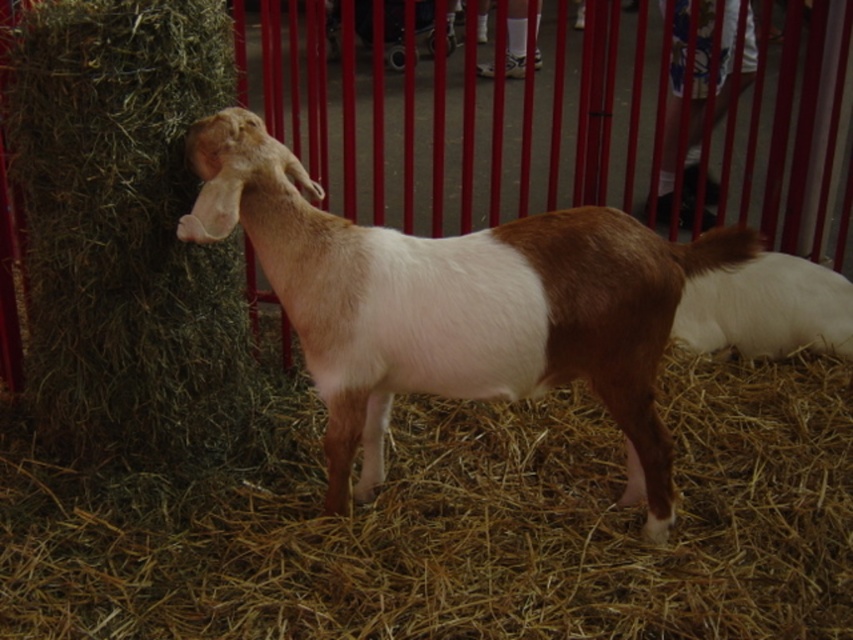
Is point (485, 458) positioned behind point (715, 285)?

No, (485, 458) is in front of (715, 285).

Locate an element on the screen. This screenshot has height=640, width=853. brown straw at center is located at coordinates (469, 525).

Find the location of a particular element. The height and width of the screenshot is (640, 853). brown straw at center is located at coordinates (469, 525).

In the scene shown: Does brown straw at center appear on the right side of brown/white fur goat at center?

Indeed, brown straw at center is positioned on the right side of brown/white fur goat at center.

Which is above, brown straw at center or brown/white fur goat at center?

brown/white fur goat at center

Who is more forward, (x=56, y=552) or (x=442, y=282)?

Point (x=442, y=282) is in front.

The image size is (853, 640). In order to click on brown straw at center in this screenshot , I will do `click(469, 525)`.

Who is lower down, brown/white fur goat at center or white soft fur goat at right?

brown/white fur goat at center is below.

Is point (608, 220) closer to viewer compared to point (741, 323)?

That is True.

Does point (294, 202) lie in front of point (741, 273)?

That is True.

Identify the location of brown/white fur goat at center. The height and width of the screenshot is (640, 853). (456, 305).